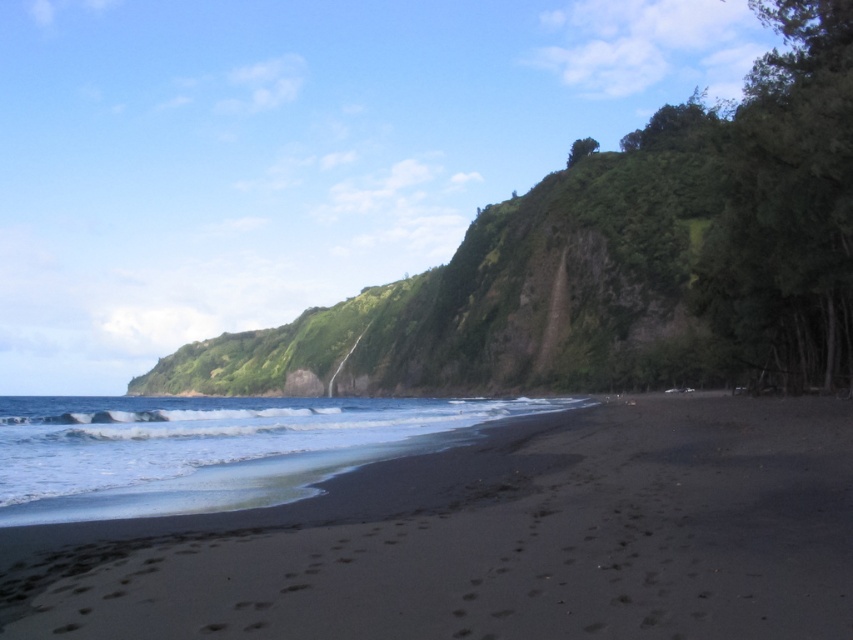
You are standing on the black sand at lower center and want to reach the clear water at lower left. Which direction should you move to get there?

Since the black sand at lower center is in front of clear water at lower left, you should move forward towards the clear water at lower left to reach it.